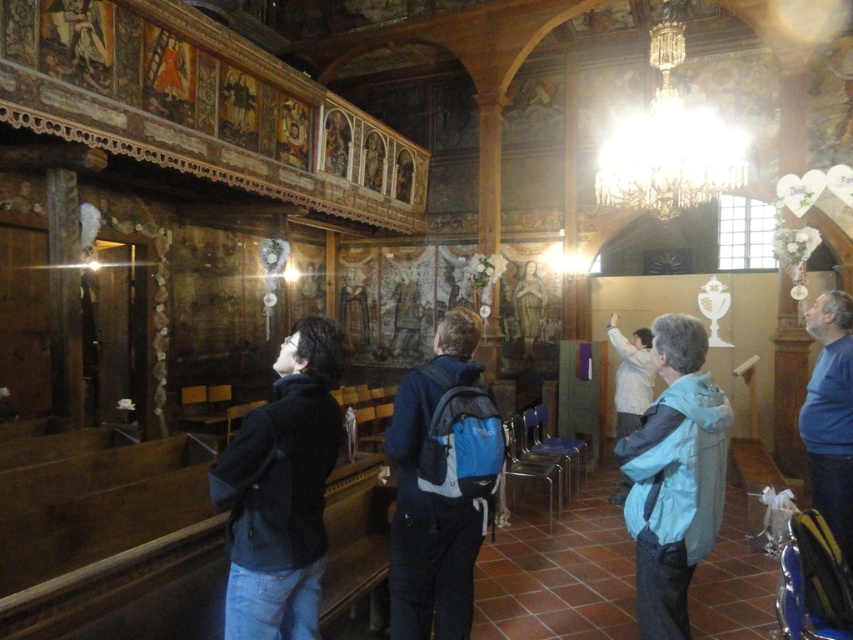
Can you confirm if black soft jacket at center is positioned to the right of white matte jacket at center?

No, black soft jacket at center is not to the right of white matte jacket at center.

Is black soft jacket at center shorter than white matte jacket at center?

No, black soft jacket at center is not shorter than white matte jacket at center.

Does point (340, 336) lie behind point (647, 387)?

That is False.

Image resolution: width=853 pixels, height=640 pixels. Find the location of `black soft jacket at center`. black soft jacket at center is located at coordinates (281, 490).

In order to click on black soft jacket at center in this screenshot , I will do `click(281, 490)`.

Is black soft jacket at center positioned behind light blue fabric jacket at lower right?

No.

I want to click on black soft jacket at center, so click(281, 490).

Locate an element on the screen. This screenshot has width=853, height=640. black soft jacket at center is located at coordinates (281, 490).

Is light blue fabric jacket at lower right bigger than white matte jacket at center?

No, light blue fabric jacket at lower right is not bigger than white matte jacket at center.

Is light blue fabric jacket at lower right further to camera compared to white matte jacket at center?

No, it is in front of white matte jacket at center.

Describe the element at coordinates (674, 476) in the screenshot. I see `light blue fabric jacket at lower right` at that location.

Locate an element on the screen. Image resolution: width=853 pixels, height=640 pixels. light blue fabric jacket at lower right is located at coordinates (674, 476).